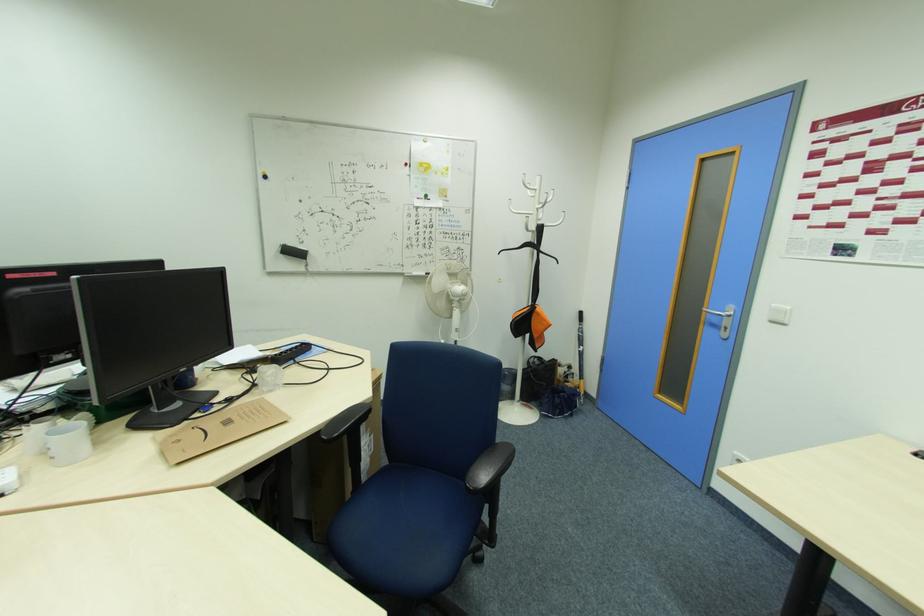
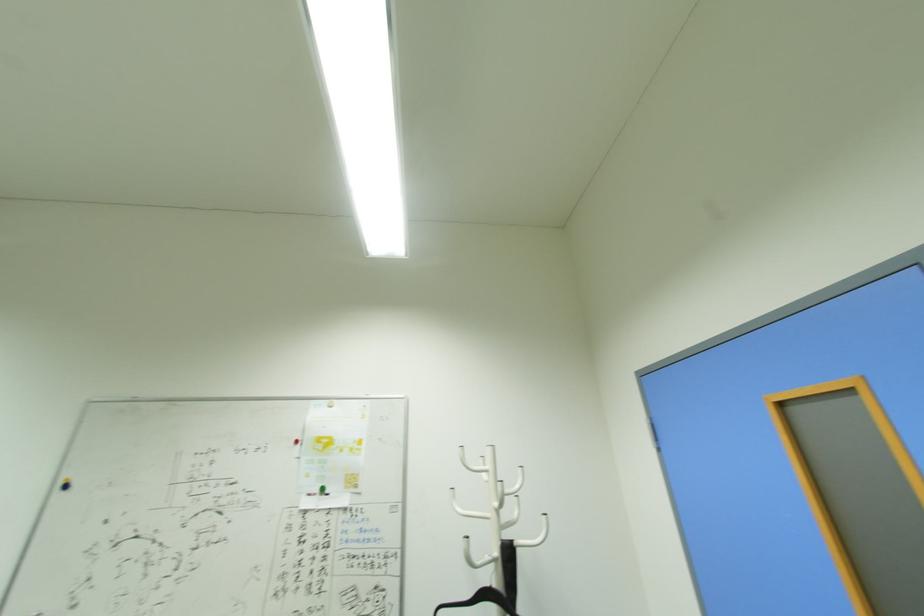
Locate, in the second image, the point that corresponds to (541,179) in the first image.

(493, 451)